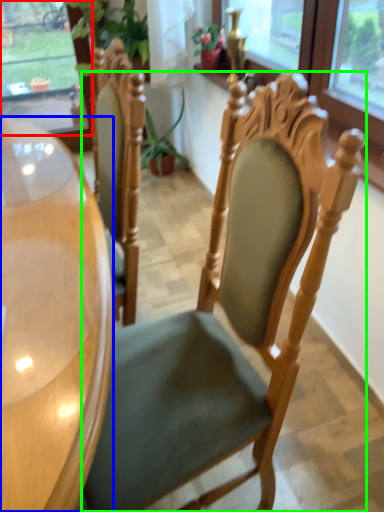
Question: Based on their relative distances, which object is nearer to window (highlighted by a red box)? Choose from desk (highlighted by a blue box) and chair (highlighted by a green box).

Choices:
 (A) desk
 (B) chair

Answer: (A)